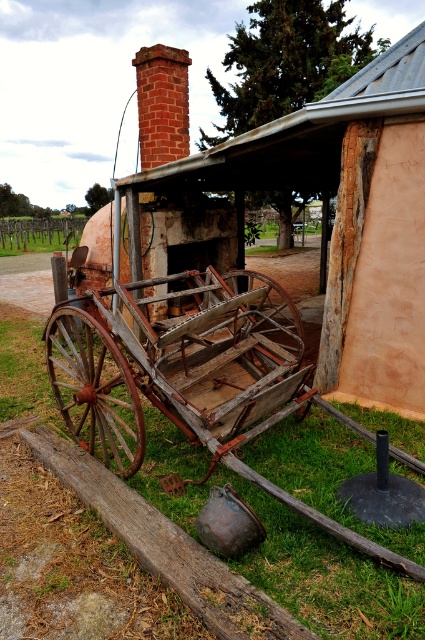
Question: Which object is positioned closest to the rusty wood cart at center?

Choices:
 (A) rusty wooden wagon wheel at center
 (B) rusty wood cart at lower left
 (C) rusty wood wagon wheel at lower left

Answer: (B)

Question: Which of the following is the farthest from the observer?

Choices:
 (A) rusty wood cart at lower left
 (B) rusty wood wagon wheel at lower left
 (C) rusty wood cart at center
 (D) rusty wooden wagon wheel at center

Answer: (D)

Question: Observing the image, what is the correct spatial positioning of rusty wood cart at center in reference to rusty wood cart at lower left?

Choices:
 (A) left
 (B) right

Answer: (B)

Question: Is rusty wood wagon wheel at lower left to the right of rusty wooden wagon wheel at center from the viewer's perspective?

Choices:
 (A) no
 (B) yes

Answer: (A)

Question: Does rusty wood cart at center appear over rusty wood cart at lower left?

Choices:
 (A) no
 (B) yes

Answer: (B)

Question: Which object is farther from the camera taking this photo?

Choices:
 (A) rusty wood wagon wheel at lower left
 (B) rusty wooden wagon wheel at center
 (C) rusty wood cart at center

Answer: (B)